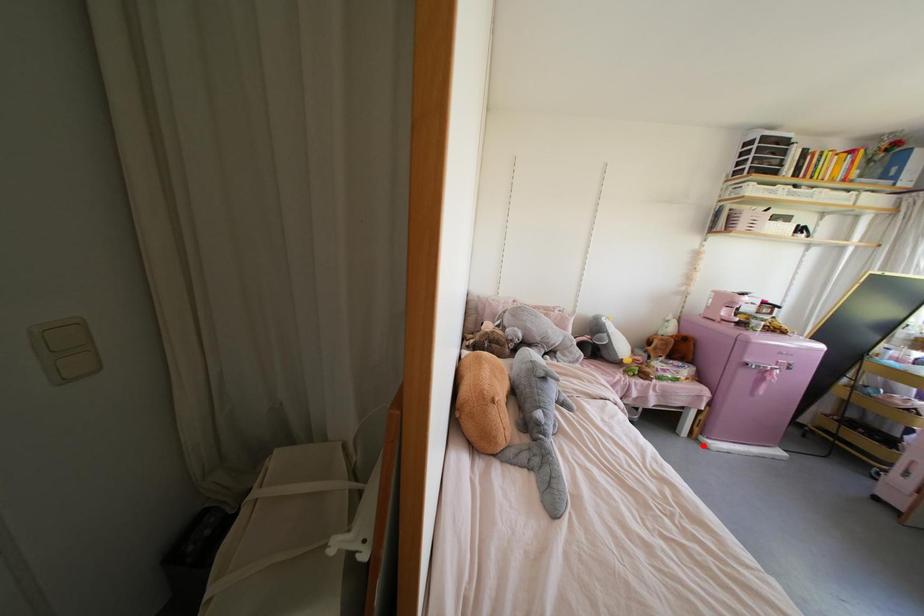
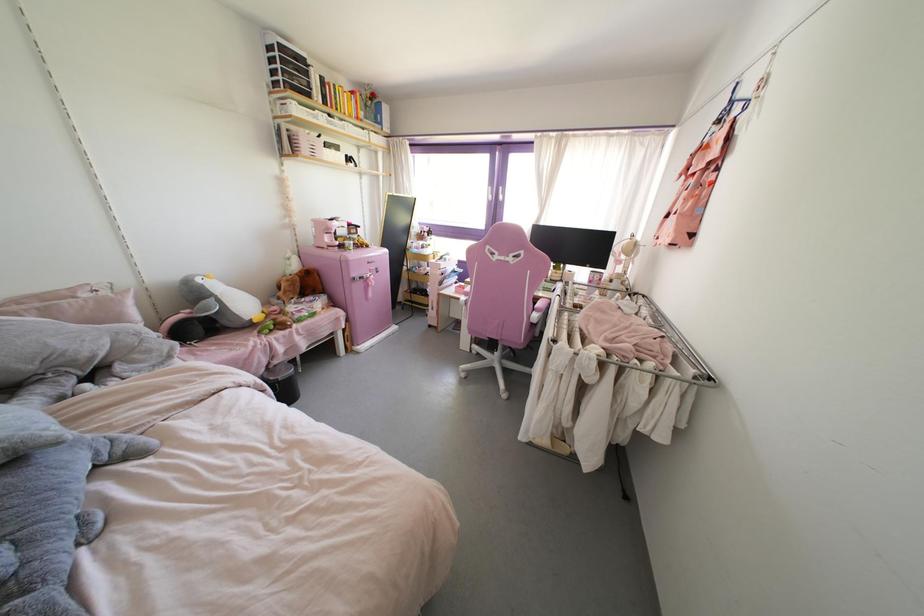
Locate, in the second image, the point that corresponds to the highlighted location in the first image.

(357, 352)